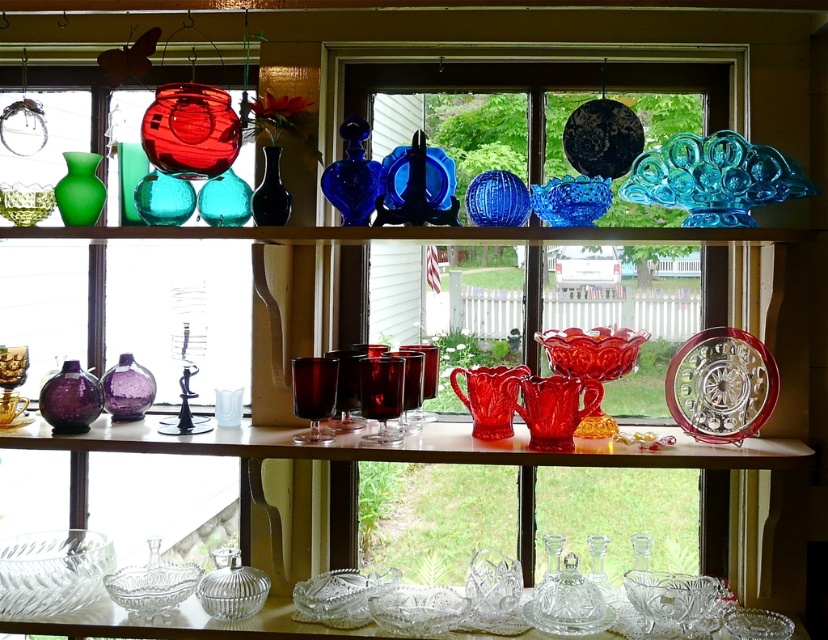
Which is in front, point (7, 556) or point (131, 369)?

Point (7, 556) is in front.

Is clear crystal bowl at lower left wider than purple glass vase at center?

Correct, the width of clear crystal bowl at lower left exceeds that of purple glass vase at center.

Image resolution: width=828 pixels, height=640 pixels. Identify the location of clear crystal bowl at lower left. (51, 572).

Is point (477, 83) closer to viewer compared to point (130, 381)?

No, (477, 83) is behind (130, 381).

Describe the element at coordinates (472, 108) in the screenshot. The height and width of the screenshot is (640, 828). I see `transparent glass bowl at center` at that location.

Identify the location of transparent glass bowl at center. (472, 108).

Is purple glass vase at lower left wider than matte green glass vase at left?

Indeed, purple glass vase at lower left has a greater width compared to matte green glass vase at left.

Who is taller, purple glass vase at lower left or matte green glass vase at left?

Standing taller between the two is matte green glass vase at left.

Identify the location of purple glass vase at lower left. The image size is (828, 640). (70, 400).